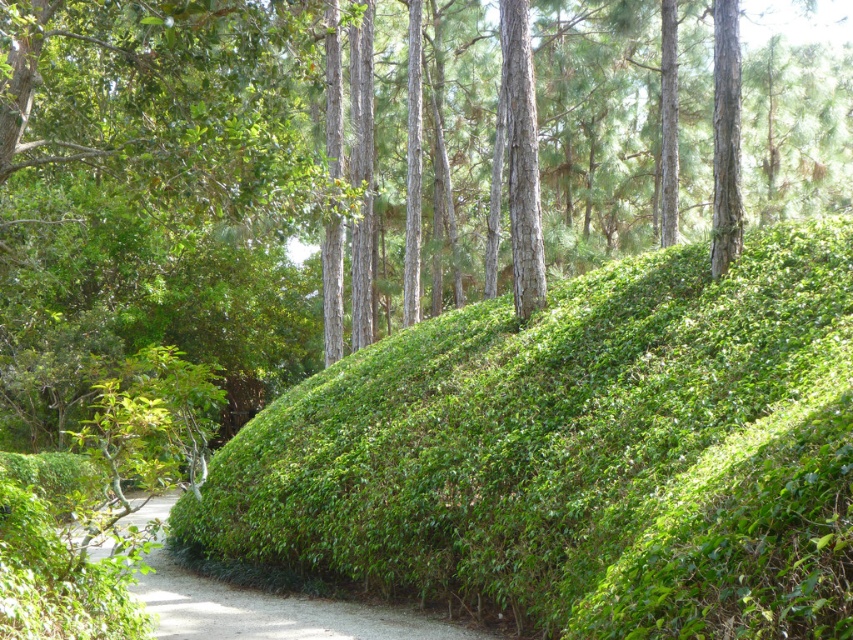
Who is positioned more to the right, green leafy hedge at center or smooth brown tree trunk at center?

green leafy hedge at center is more to the right.

This screenshot has height=640, width=853. Describe the element at coordinates (579, 452) in the screenshot. I see `green leafy hedge at center` at that location.

This screenshot has width=853, height=640. What are the coordinates of `green leafy hedge at center` in the screenshot? It's located at (579, 452).

Between green leafy hedge at center and green leafy hedge at lower left, which one is positioned higher?

green leafy hedge at center is higher up.

Which is in front, point (786, 548) or point (151, 499)?

Point (786, 548) is more forward.

Locate an element on the screen. green leafy hedge at center is located at coordinates (579, 452).

Is green leafy hedge at lower left to the left of smooth brown tree trunk at center from the viewer's perspective?

Indeed, green leafy hedge at lower left is positioned on the left side of smooth brown tree trunk at center.

Measure the distance between green leafy hedge at lower left and smooth brown tree trunk at center.

green leafy hedge at lower left is 7.21 meters away from smooth brown tree trunk at center.

What do you see at coordinates (273, 611) in the screenshot? The width and height of the screenshot is (853, 640). I see `green leafy hedge at lower left` at bounding box center [273, 611].

Identify the location of green leafy hedge at lower left. (273, 611).